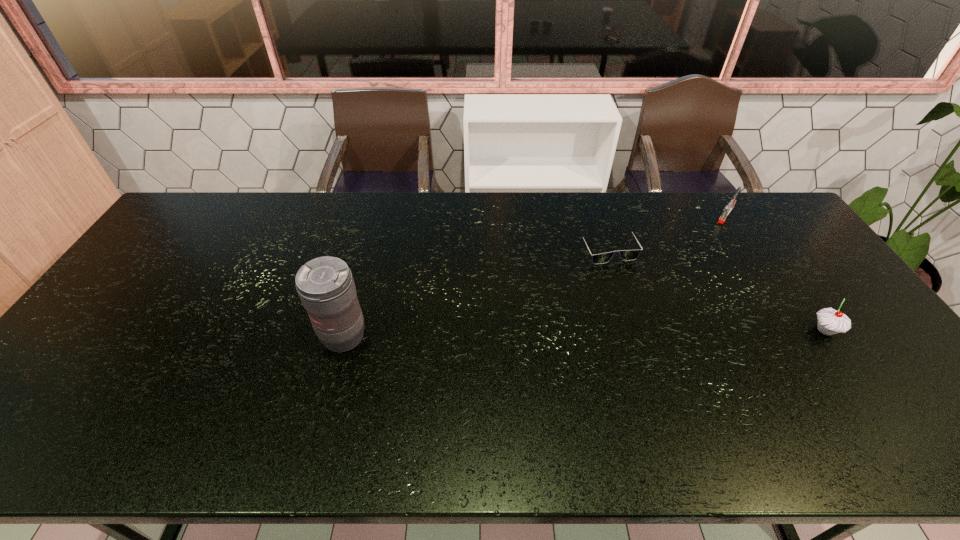
You are a GUI agent. You are given a task and a screenshot of the screen. Output one action in this format:
    pyautogui.click(x=<x>, y=<y>)
    Task: Click on the empty location between the telephoto lens and the stapler
    Image resolution: width=960 pixels, height=540 pixels.
    Given the screenshot: What is the action you would take?
    pyautogui.click(x=535, y=276)

Find the location of a particular element. empty space that is in between the sunglasses and the second shortest object is located at coordinates tap(666, 231).

Where is `vacant point located between the second tallest object and the third tallest object`? The height and width of the screenshot is (540, 960). vacant point located between the second tallest object and the third tallest object is located at coordinates (776, 273).

Where is `unoccupied area between the shortest object and the telephoto lens`? unoccupied area between the shortest object and the telephoto lens is located at coordinates tap(475, 292).

Locate an element on the screen. vacant region between the sunglasses and the farthest object is located at coordinates (666, 231).

Identify the location of empty space that is in between the cupcake and the stapler. The height and width of the screenshot is (540, 960). (776, 273).

Locate which object is the second closest to the telephoto lens. Please provide its 2D coordinates. Your answer should be formatted as a tuple, i.e. [(x, y)], where the tuple contains the x and y coordinates of a point satisfying the conditions above.

[(830, 321)]

Identify which object is the second closest to the third shortest object. Please provide its 2D coordinates. Your answer should be formatted as a tuple, i.e. [(x, y)], where the tuple contains the x and y coordinates of a point satisfying the conditions above.

[(626, 255)]

The width and height of the screenshot is (960, 540). I want to click on free space that satisfies the following two spatial constraints: 1. on the back side of the third object from right to left; 2. on the left side of the stapler, so click(x=596, y=215).